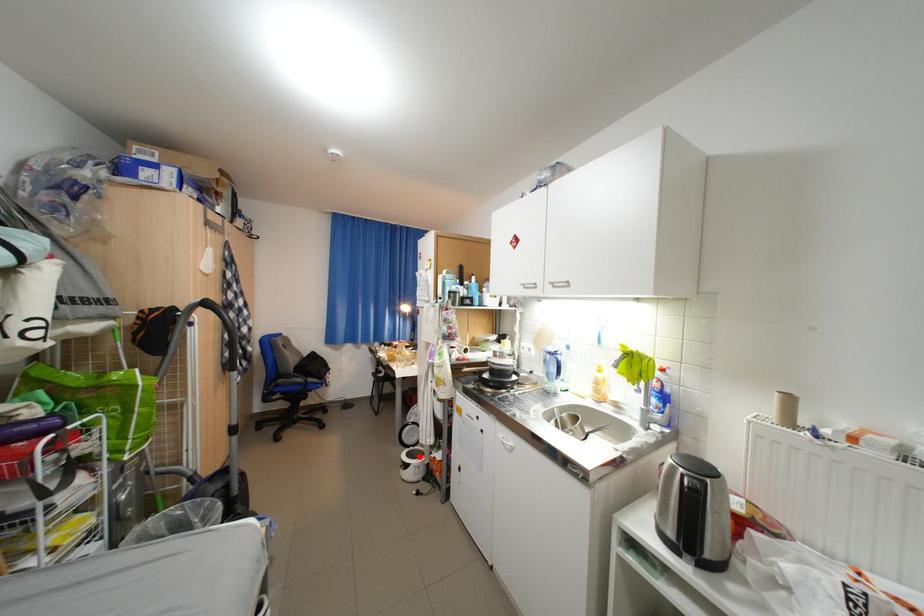
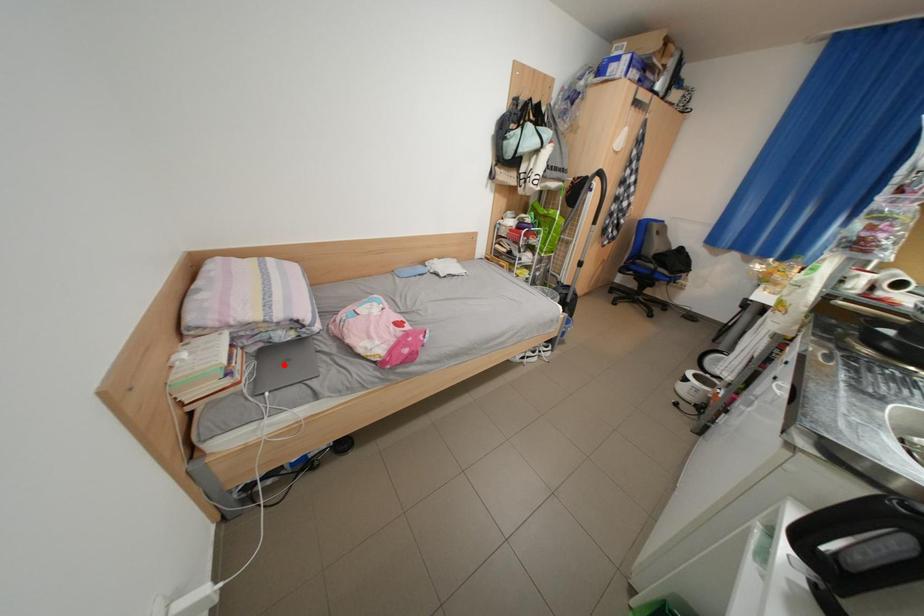
I am providing you with two images of the same scene from different viewpoints. A red point is marked on the first image and another point is marked on the second image. Is the red point in image1 aligned with the point shown in image2?

No